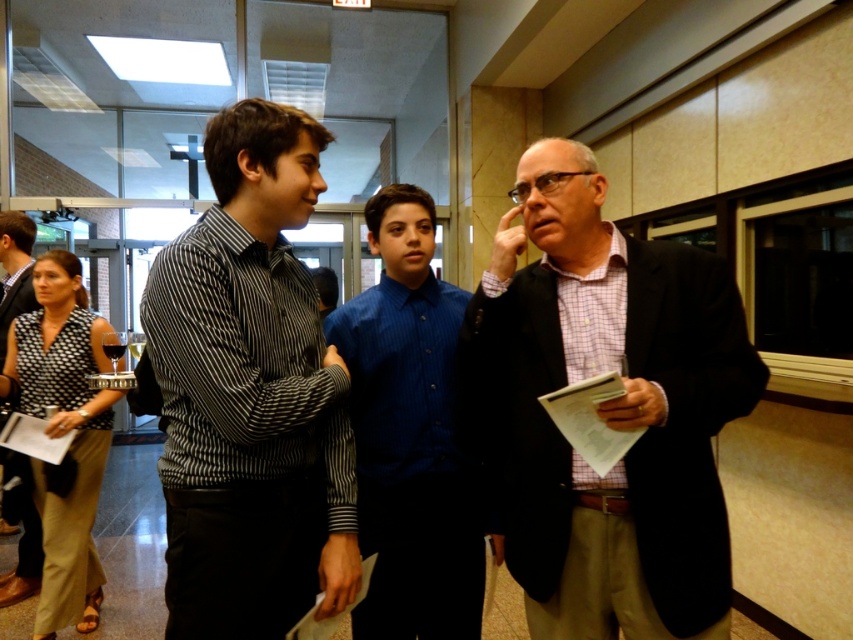
Question: Which object is closer to the camera taking this photo?

Choices:
 (A) striped cotton shirt at center
 (B) black shirt at left

Answer: (A)

Question: Is blue button-down shirt at center below black shirt at left?

Choices:
 (A) no
 (B) yes

Answer: (B)

Question: Which of the following is the farthest from the observer?

Choices:
 (A) blue button-down shirt at center
 (B) striped cotton shirt at center

Answer: (A)

Question: Considering the relative positions of striped cotton shirt at center and black shirt at left in the image provided, where is striped cotton shirt at center located with respect to black shirt at left?

Choices:
 (A) below
 (B) above

Answer: (A)

Question: Does striped cotton shirt at center appear under black shirt at left?

Choices:
 (A) yes
 (B) no

Answer: (A)

Question: Which object is farther from the camera taking this photo?

Choices:
 (A) striped cotton shirt at center
 (B) black shirt at left
 (C) blue button-down shirt at center
 (D) plaid fabric shirt at center

Answer: (B)